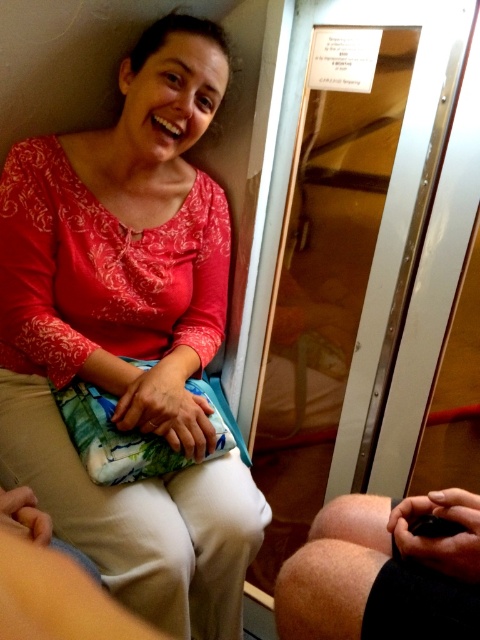
Question: Is matte floral skirt at center thinner than hairy skin at lower right?

Choices:
 (A) no
 (B) yes

Answer: (A)

Question: Which object is closer to the camera taking this photo?

Choices:
 (A) matte floral skirt at center
 (B) hairy skin at lower right

Answer: (B)

Question: Does matte floral skirt at center have a larger size compared to hairy skin at lower right?

Choices:
 (A) no
 (B) yes

Answer: (B)

Question: Does matte floral skirt at center have a lesser width compared to hairy skin at lower right?

Choices:
 (A) yes
 (B) no

Answer: (B)